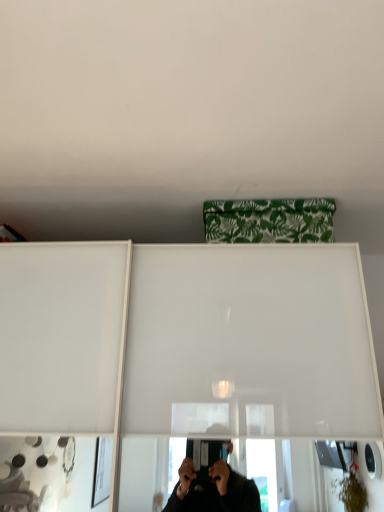
Measure the distance between point (267, 237) and camera.

A distance of 1.50 meters exists between point (267, 237) and camera.

Describe the element at coordinates (269, 221) in the screenshot. I see `green leaf-patterned fabric at upper center` at that location.

At what (x,y) coordinates should I click in order to perform the action: click on green leaf-patterned fabric at upper center. Please return your answer as a coordinate pair (x, y). The image size is (384, 512). Looking at the image, I should click on tap(269, 221).

This screenshot has width=384, height=512. In order to click on green leaf-patterned fabric at upper center in this screenshot , I will do `click(269, 221)`.